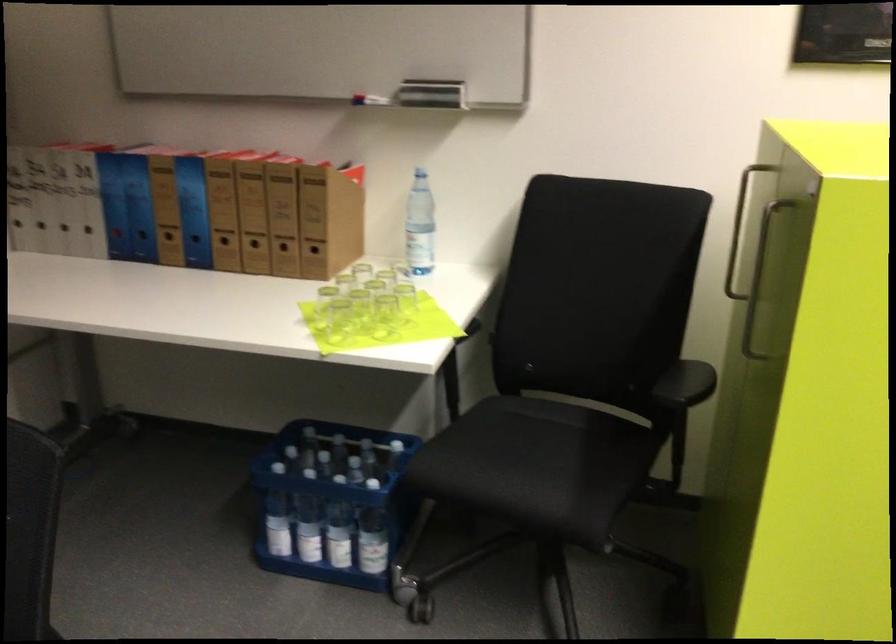
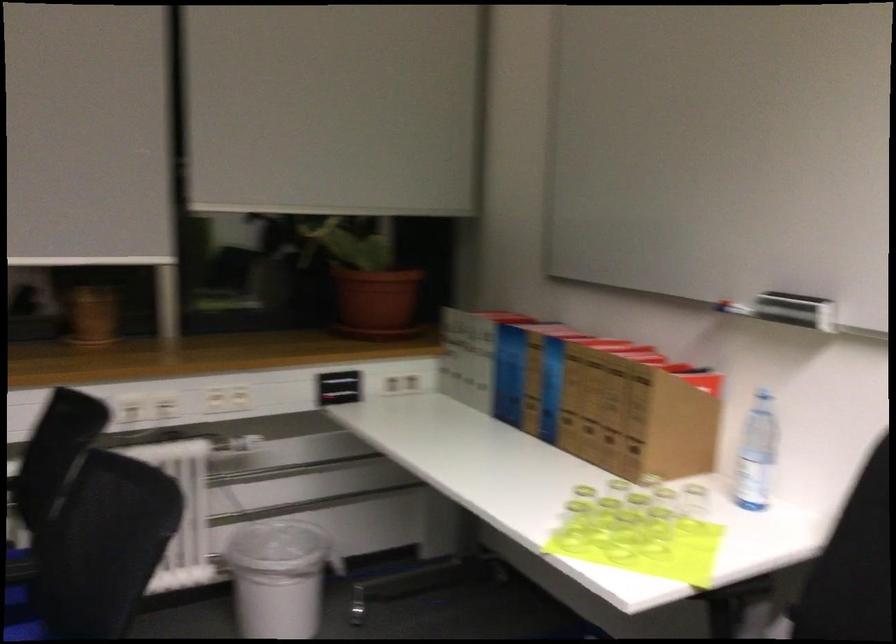
Find the pixel in the second image that matches (x=365, y=319) in the first image.

(623, 536)